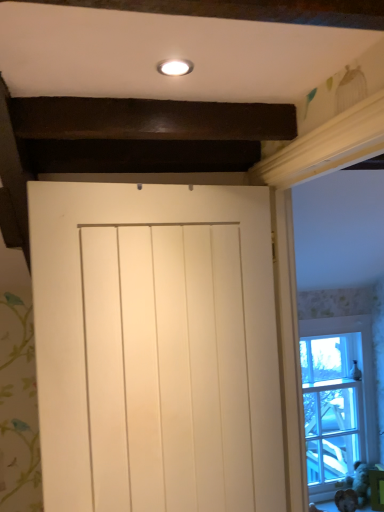
Question: Can you confirm if white painted wood at upper right is bigger than clear glass window at right?

Choices:
 (A) no
 (B) yes

Answer: (B)

Question: Is clear glass window at right at the back of white painted wood at upper right?

Choices:
 (A) yes
 (B) no

Answer: (B)

Question: From the image's perspective, does white painted wood at upper right appear lower than clear glass window at right?

Choices:
 (A) yes
 (B) no

Answer: (B)

Question: Does white painted wood at upper right have a greater width compared to clear glass window at right?

Choices:
 (A) yes
 (B) no

Answer: (A)

Question: Is white painted wood at upper right outside of clear glass window at right?

Choices:
 (A) no
 (B) yes

Answer: (B)

Question: Is point (326, 300) closer or farther from the camera than point (304, 397)?

Choices:
 (A) farther
 (B) closer

Answer: (A)

Question: From the image's perspective, is white painted wood at upper right positioned above or below clear glass window at right?

Choices:
 (A) above
 (B) below

Answer: (A)

Question: Is white painted wood at upper right bigger or smaller than clear glass window at right?

Choices:
 (A) big
 (B) small

Answer: (A)

Question: Considering their positions, is white painted wood at upper right located in front of or behind clear glass window at right?

Choices:
 (A) front
 (B) behind

Answer: (A)

Question: Is white matte door at center to the left or to the right of brown furry animal at lower right in the image?

Choices:
 (A) right
 (B) left

Answer: (B)

Question: From the image's perspective, is white matte door at center above or below brown furry animal at lower right?

Choices:
 (A) below
 (B) above

Answer: (B)

Question: Is white matte door at center wider or thinner than brown furry animal at lower right?

Choices:
 (A) thin
 (B) wide

Answer: (B)

Question: Is point (155, 463) closer or farther from the camera than point (339, 490)?

Choices:
 (A) farther
 (B) closer

Answer: (B)

Question: From the image's perspective, is brown furry animal at lower right positioned above or below white matte door at center?

Choices:
 (A) below
 (B) above

Answer: (A)

Question: Considering their positions, is brown furry animal at lower right located in front of or behind white matte door at center?

Choices:
 (A) behind
 (B) front

Answer: (A)